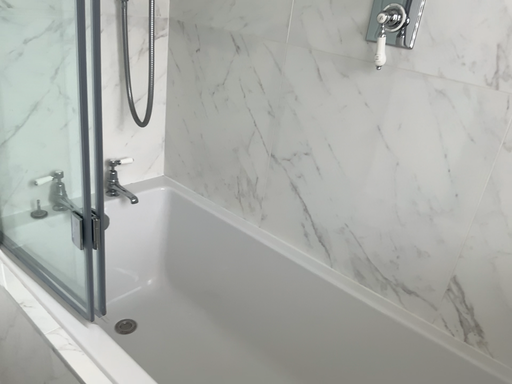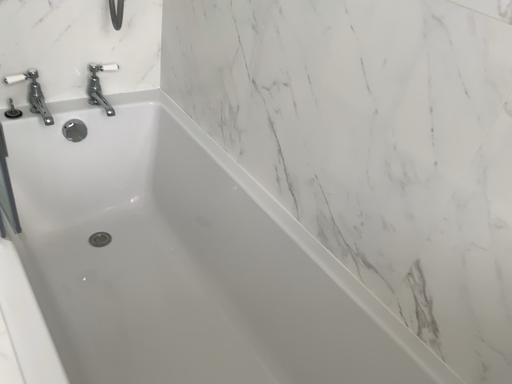
Question: Which way did the camera rotate in the video?

Choices:
 (A) rotated downward
 (B) rotated upward

Answer: (A)